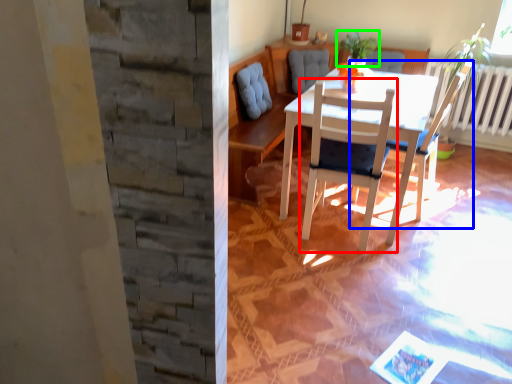
Question: Which object is the farthest from chair (highlighted by a red box)? Choose among these: chair (highlighted by a blue box) or houseplant (highlighted by a green box).

Choices:
 (A) chair
 (B) houseplant

Answer: (B)